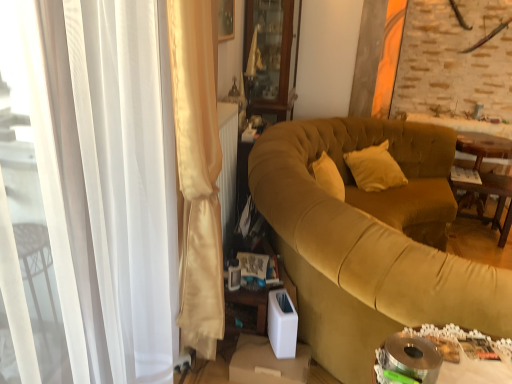
Question: Is wooden cabinet at upper center far from wooden table at right, marked as the 2th table in a front-to-back arrangement?

Choices:
 (A) yes
 (B) no

Answer: (A)

Question: Can wooden table at right, which is the 2th table in right-to-left order, be found inside wooden cabinet at upper center?

Choices:
 (A) no
 (B) yes

Answer: (A)

Question: Is wooden cabinet at upper center oriented towards wooden table at right, which is the 2th table in right-to-left order?

Choices:
 (A) yes
 (B) no

Answer: (A)

Question: From a real-world perspective, is wooden cabinet at upper center below wooden table at right, which is the 2th table in right-to-left order?

Choices:
 (A) yes
 (B) no

Answer: (B)

Question: Does wooden cabinet at upper center appear on the right side of wooden table at right, which is the 2th table in right-to-left order?

Choices:
 (A) no
 (B) yes

Answer: (A)

Question: Choose the correct answer: Is metallic silver tray at lower right, marked as the third table in a right-to-left arrangement, inside wooden table at right, the third table positioned from the left, or outside it?

Choices:
 (A) inside
 (B) outside

Answer: (B)

Question: In the image, is metallic silver tray at lower right, which is the third table from back to front, positioned in front of or behind wooden table at right, the third table in the front-to-back sequence?

Choices:
 (A) behind
 (B) front

Answer: (B)

Question: Looking at their shapes, would you say metallic silver tray at lower right, the 1th table viewed from the left, is wider or thinner than wooden table at right, arranged as the first table when viewed from the back?

Choices:
 (A) thin
 (B) wide

Answer: (A)

Question: From the image's perspective, is metallic silver tray at lower right, marked as the third table in a right-to-left arrangement, above or below wooden table at right, arranged as the first table when viewed from the back?

Choices:
 (A) above
 (B) below

Answer: (B)

Question: Considering the positions of wooden cabinet at upper center and velvet mustard couch at center in the image, is wooden cabinet at upper center taller or shorter than velvet mustard couch at center?

Choices:
 (A) tall
 (B) short

Answer: (A)

Question: Choose the correct answer: Is wooden cabinet at upper center inside velvet mustard couch at center or outside it?

Choices:
 (A) outside
 (B) inside

Answer: (A)

Question: Looking at the image, does wooden cabinet at upper center seem bigger or smaller compared to velvet mustard couch at center?

Choices:
 (A) small
 (B) big

Answer: (A)

Question: Considering the positions of point (286, 13) and point (356, 221), is point (286, 13) closer or farther from the camera than point (356, 221)?

Choices:
 (A) farther
 (B) closer

Answer: (A)

Question: In the image, is satin white curtain at left positioned in front of or behind metallic silver tray at lower right, the 1th table viewed from the left?

Choices:
 (A) behind
 (B) front

Answer: (A)

Question: From a real-world perspective, is satin white curtain at left physically located above or below metallic silver tray at lower right, marked as the third table in a right-to-left arrangement?

Choices:
 (A) below
 (B) above

Answer: (B)